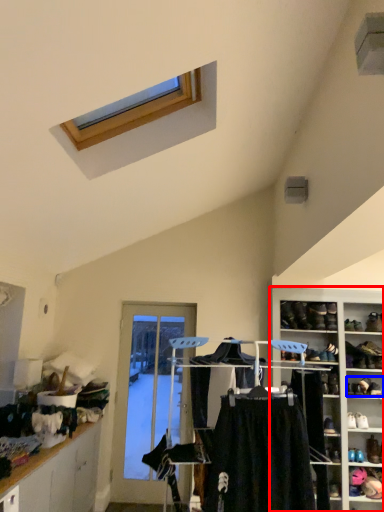
Question: Among these objects, which one is farthest to the camera, shelf (highlighted by a red box) or footwear (highlighted by a blue box)?

Choices:
 (A) shelf
 (B) footwear

Answer: (B)